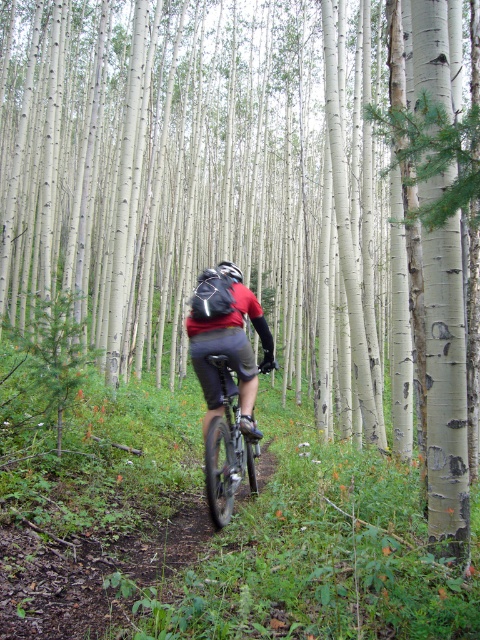
Between matte black helmet at center and shiny silver helmet at center, which one appears on the left side from the viewer's perspective?

Positioned to the left is shiny silver helmet at center.

Is matte black helmet at center shorter than shiny silver helmet at center?

Incorrect, matte black helmet at center's height does not fall short of shiny silver helmet at center's.

Where is `matte black helmet at center`? matte black helmet at center is located at coordinates pyautogui.click(x=227, y=342).

Where is `matte black helmet at center`? Image resolution: width=480 pixels, height=640 pixels. matte black helmet at center is located at coordinates click(227, 342).

Between shiny metallic bicycle at center and shiny silver helmet at center, which one has more height?

Standing taller between the two is shiny metallic bicycle at center.

Between shiny metallic bicycle at center and shiny silver helmet at center, which one is positioned lower?

shiny metallic bicycle at center

Is point (220, 451) positioned in front of point (238, 282)?

No, it is not.

The height and width of the screenshot is (640, 480). I want to click on shiny metallic bicycle at center, so tap(228, 449).

Is matte black helmet at center bigger than shiny metallic bicycle at center?

Incorrect, matte black helmet at center is not larger than shiny metallic bicycle at center.

Is the position of matte black helmet at center more distant than that of shiny metallic bicycle at center?

Yes, it is behind shiny metallic bicycle at center.

Does point (226, 289) come farther from viewer compared to point (249, 481)?

That is False.

Image resolution: width=480 pixels, height=640 pixels. I want to click on matte black helmet at center, so click(227, 342).